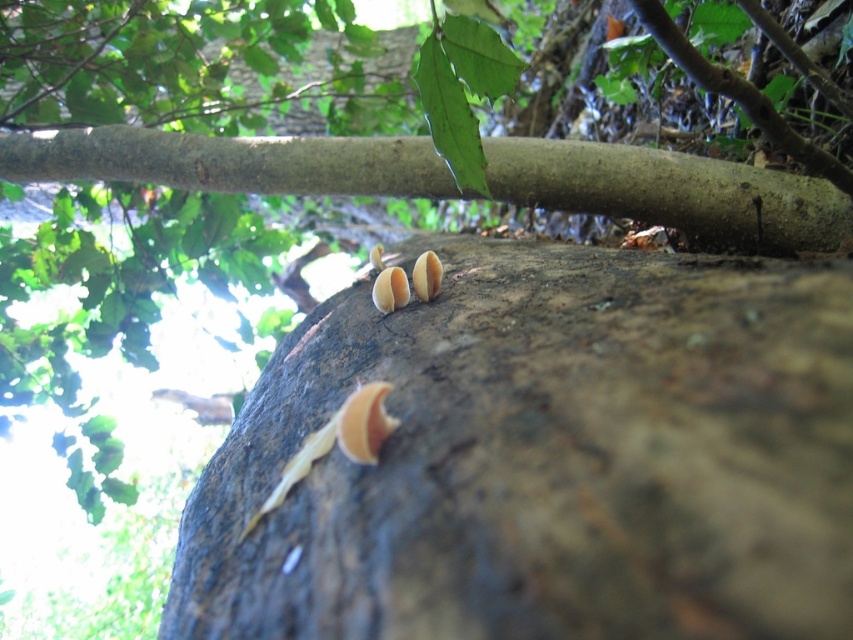
Does brown rough bark at center come behind smooth beige fungi at center?

No, it is not.

Where is `brown rough bark at center`? brown rough bark at center is located at coordinates (x=546, y=458).

Which is in front, point (618, 209) or point (392, 308)?

Positioned in front is point (392, 308).

Is smooth brown branch at upper center to the left of smooth beige fungi at center from the viewer's perspective?

Yes, smooth brown branch at upper center is to the left of smooth beige fungi at center.

Between point (718, 225) and point (390, 296), which one is positioned behind?

Point (718, 225)

Where is `smooth brown branch at upper center`? The image size is (853, 640). smooth brown branch at upper center is located at coordinates pyautogui.click(x=670, y=192).

Is brown rough bark at center thinner than smooth brown branch at upper center?

Correct, brown rough bark at center's width is less than smooth brown branch at upper center's.

Can you confirm if brown rough bark at center is shorter than smooth brown branch at upper center?

Incorrect, brown rough bark at center's height does not fall short of smooth brown branch at upper center's.

Which is behind, point (700, 483) or point (209, 141)?

The point (209, 141) is behind.

I want to click on brown rough bark at center, so click(546, 458).